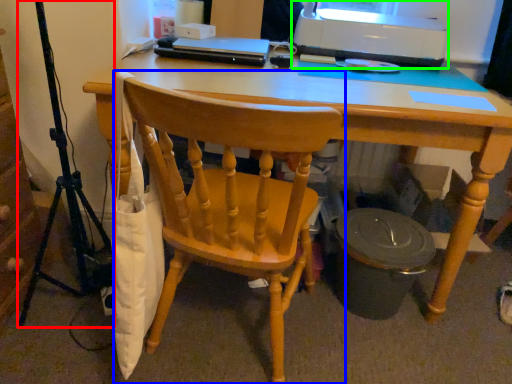
Question: Based on their relative distances, which object is nearer to tripod (highlighted by a red box)? Choose from chair (highlighted by a blue box) and printer (highlighted by a green box).

Choices:
 (A) chair
 (B) printer

Answer: (A)